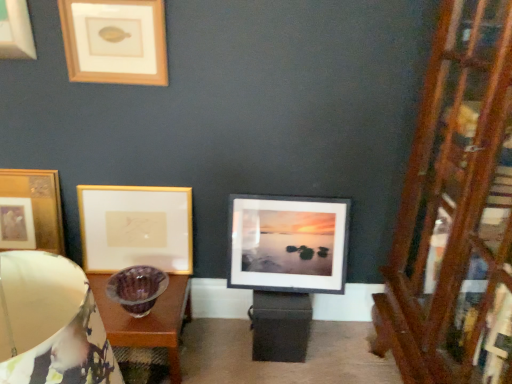
Question: Visually, is matte purple glass bowl at left positioned to the left or to the right of gold metallic picture frame at upper left, which is counted as the 1th picture frame, starting from the left?

Choices:
 (A) left
 (B) right

Answer: (B)

Question: From the image's perspective, is matte purple glass bowl at left above or below gold metallic picture frame at upper left, marked as the fourth picture frame in a right-to-left arrangement?

Choices:
 (A) below
 (B) above

Answer: (A)

Question: Considering the real-world distances, which object is closest to the gold/matte picture frame at upper left, the second picture frame from the right?

Choices:
 (A) matte purple glass bowl at left
 (B) white matte picture frame at center, which is the 4th picture frame from left to right
 (C) wooden at right
 (D) gold/glossy picture frame at upper left, marked as the second picture frame in a left-to-right arrangement
 (E) gold metallic picture frame at upper left, which is counted as the 1th picture frame, starting from the left

Answer: (D)

Question: Which of these objects is positioned farthest from the white matte picture frame at center, placed as the first picture frame when sorted from right to left?

Choices:
 (A) gold/glossy picture frame at upper left, the 3th picture frame in the right-to-left sequence
 (B) gold metallic picture frame at upper left, which is counted as the 1th picture frame, starting from the left
 (C) gold/matte picture frame at upper left, the 3th picture frame positioned from the left
 (D) matte purple glass bowl at left
 (E) wooden at right

Answer: (D)